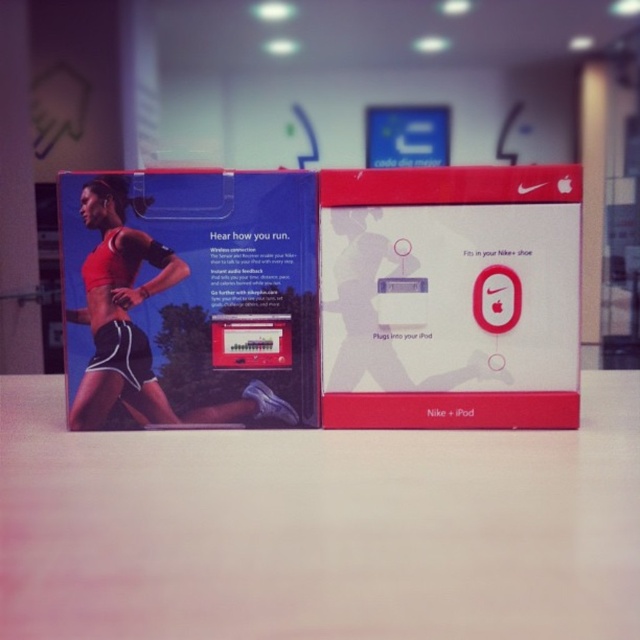
You are placing a small vase on the white matte table at center. If the vase is placed at coordinate point A, which is at position 0.825 on the x axis and 0.498 on the y axis, will it overlap with any part of the two product boxes?

The white matte table at center is located at point (x=317, y=528), so placing the vase at that coordinate would overlap with the white matte table at center itself, but since the question is about overlapping with the two product boxes, the answer would depend on the boxes positions. However, the provided information does not specify the coordinates of the product boxes, only the table. Therefore, it is impossible to determine if the vase would overlap with the boxes based on the given data.

You are organizing a sports equipment store and need to place the matte red box at center and the matte black sports bra at center on a shelf. If the shelf has limited space, which item should you prioritize placing first to ensure both fit?

The matte black sports bra at center is smaller than the matte red box at center, so you should place the matte red box at center first to ensure both items fit on the shelf.